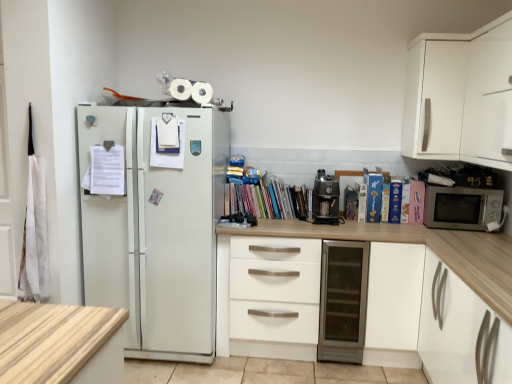
Where is `free space in front of hardcover book at right, the third paperback book positioned from the left`? The image size is (512, 384). free space in front of hardcover book at right, the third paperback book positioned from the left is located at coordinates (397, 227).